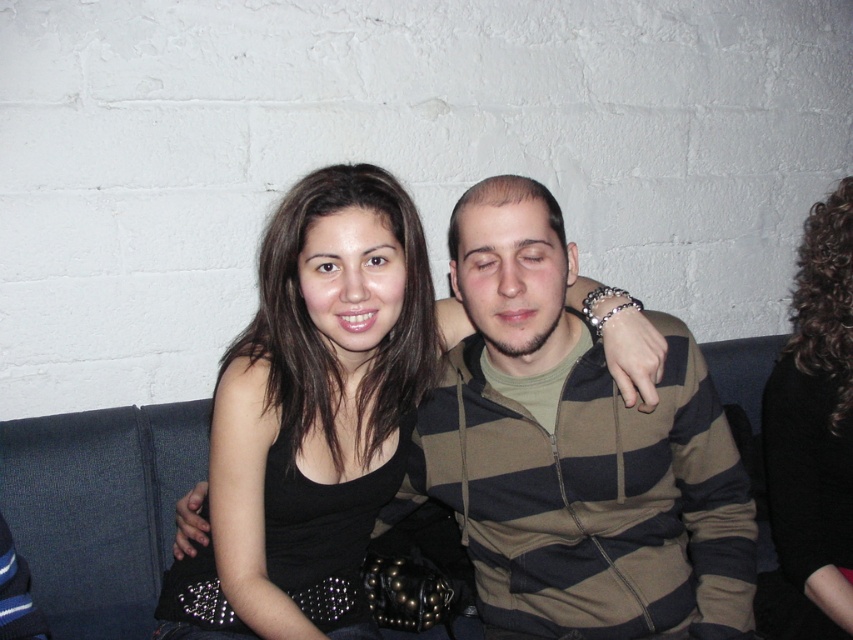
Question: Which of the following is the farthest from the observer?

Choices:
 (A) striped hoodie at center
 (B) black curly hair at upper right
 (C) black leather gloves at center

Answer: (B)

Question: Does striped hoodie at center appear under black curly hair at upper right?

Choices:
 (A) yes
 (B) no

Answer: (A)

Question: In this image, where is striped hoodie at center located relative to black leather gloves at center?

Choices:
 (A) above
 (B) below

Answer: (B)

Question: Based on their relative distances, which object is farther from the black curly hair at upper right?

Choices:
 (A) striped hoodie at center
 (B) black leather gloves at center

Answer: (B)

Question: Is black leather gloves at center wider than black curly hair at upper right?

Choices:
 (A) yes
 (B) no

Answer: (A)

Question: Among these objects, which one is farthest from the camera?

Choices:
 (A) black curly hair at upper right
 (B) black leather gloves at center

Answer: (A)